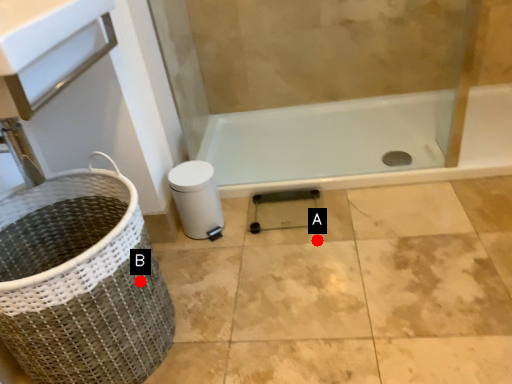
Question: Two points are circled on the image, labeled by A and B beside each circle. Among these points, which one is farthest from the camera?

Choices:
 (A) A is further
 (B) B is further

Answer: (A)